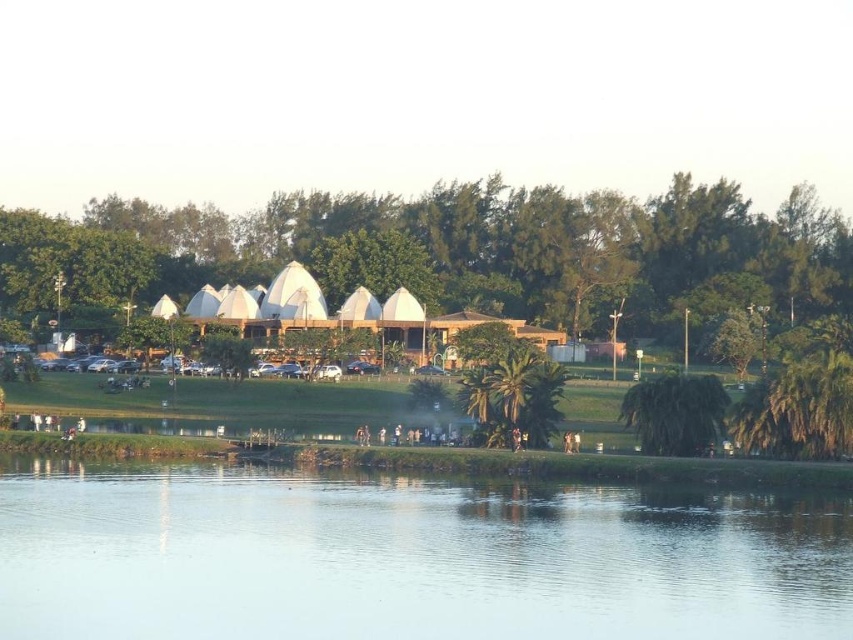
Which is behind, point (114, 296) or point (693, 396)?

The point (114, 296) is behind.

Between green leafy tree at center and green leafy tree at lower right, which one has less height?

green leafy tree at lower right is shorter.

Is point (517, 307) positioned before point (645, 406)?

No, (517, 307) is further to viewer.

At what (x,y) coordinates should I click in order to perform the action: click on green leafy tree at center. Please return your answer as a coordinate pair (x, y). The height and width of the screenshot is (640, 853). Looking at the image, I should click on (451, 252).

Is transparent water at center to the right of green leafy tree at center from the viewer's perspective?

No, transparent water at center is not to the right of green leafy tree at center.

Can you confirm if transparent water at center is positioned to the left of green leafy tree at center?

Correct, you'll find transparent water at center to the left of green leafy tree at center.

Where is `transparent water at center`? transparent water at center is located at coordinates (408, 556).

Is point (566, 374) farther from camera compared to point (657, 380)?

Yes, point (566, 374) is behind point (657, 380).

Find the location of a particular element. The height and width of the screenshot is (640, 853). green leafy palm tree at center is located at coordinates (514, 397).

Describe the element at coordinates (514, 397) in the screenshot. I see `green leafy palm tree at center` at that location.

This screenshot has height=640, width=853. What are the coordinates of `green leafy palm tree at center` in the screenshot? It's located at (514, 397).